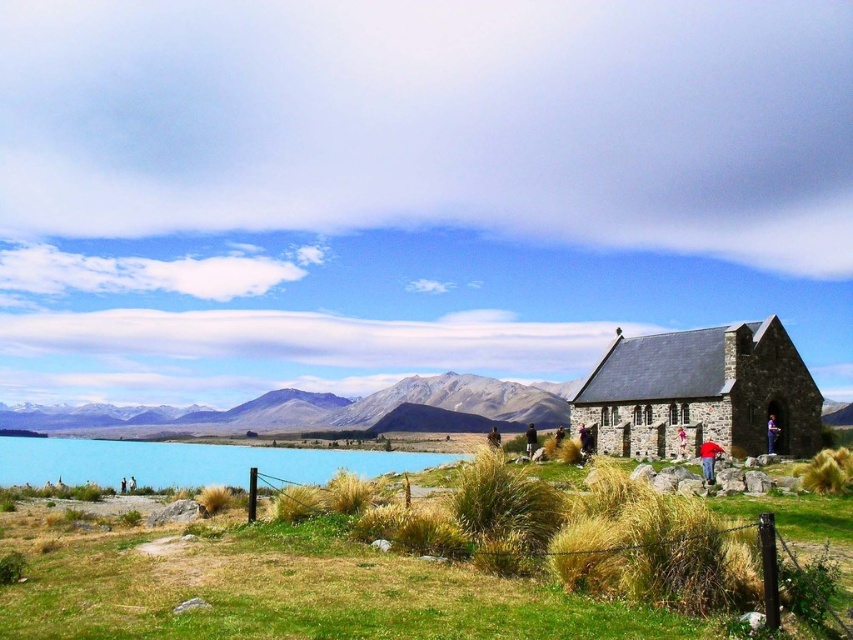
Question: Can you confirm if dry grass at center is smaller than white snow-covered mountain at center?

Choices:
 (A) yes
 (B) no

Answer: (B)

Question: Which point appears farthest from the camera in this image?

Choices:
 (A) (x=664, y=410)
 (B) (x=514, y=612)

Answer: (A)

Question: Is dry grass at center below stone church at right?

Choices:
 (A) no
 (B) yes

Answer: (B)

Question: Which point appears farthest from the camera in this image?

Choices:
 (A) (412, 401)
 (B) (778, 388)

Answer: (A)

Question: Estimate the real-world distances between objects in this image. Which object is closer to the stone church at right?

Choices:
 (A) white snow-covered mountain at center
 (B) dry grass at center
 (C) blue glassy lake at lower left

Answer: (B)

Question: Does stone church at right appear on the left side of blue glassy lake at lower left?

Choices:
 (A) no
 (B) yes

Answer: (A)